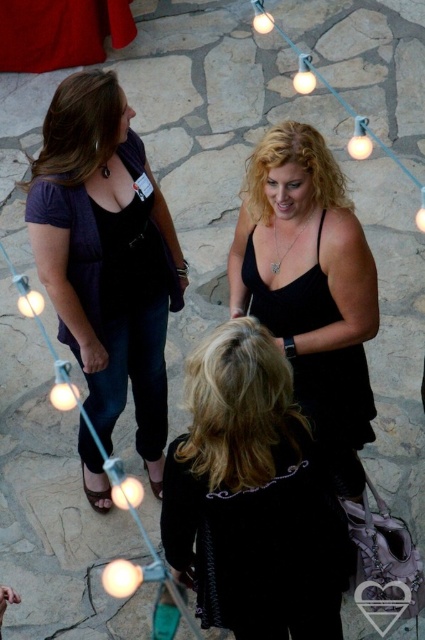
Question: Which is farther from the black velvet jacket at lower center?

Choices:
 (A) black satin dress at center
 (B) matte purple blouse at left

Answer: (B)

Question: Is black velvet jacket at lower center above black satin dress at center?

Choices:
 (A) yes
 (B) no

Answer: (B)

Question: Which point is closer to the camera?

Choices:
 (A) matte purple blouse at left
 (B) black velvet jacket at lower center

Answer: (B)

Question: Among these objects, which one is farthest from the camera?

Choices:
 (A) black velvet jacket at lower center
 (B) matte purple blouse at left

Answer: (B)

Question: Is black velvet jacket at lower center thinner than matte purple blouse at left?

Choices:
 (A) no
 (B) yes

Answer: (A)

Question: Does black velvet jacket at lower center appear under black satin dress at center?

Choices:
 (A) yes
 (B) no

Answer: (A)